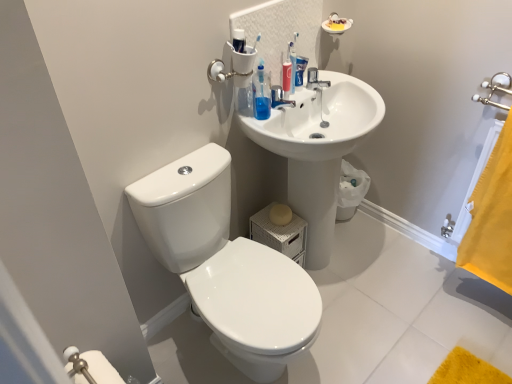
At what (x,y) coordinates should I click in order to perform the action: click on vacant area located to the right-hand side of white glossy toilet at lower left. Please return your answer as a coordinate pair (x, y). The image size is (512, 384). Looking at the image, I should click on (370, 327).